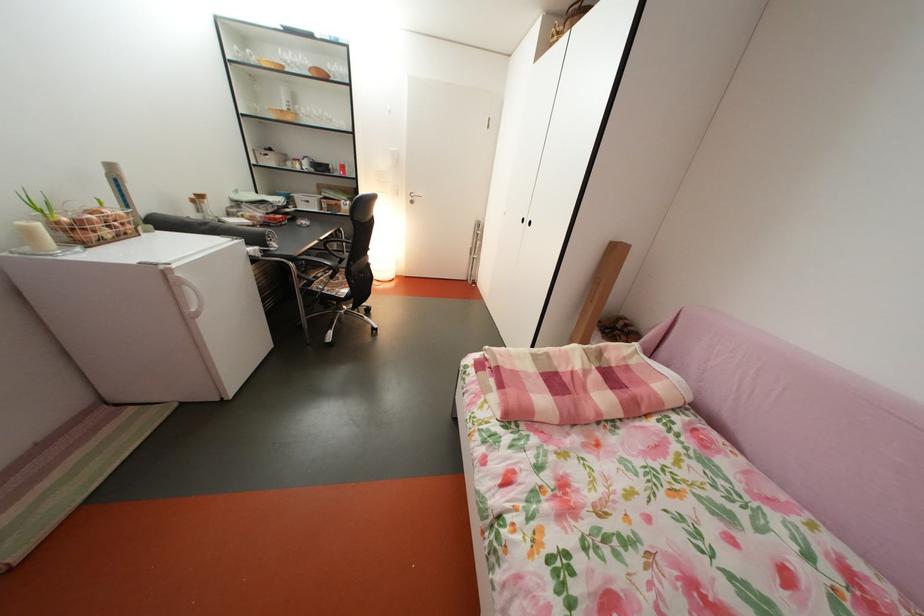
This screenshot has width=924, height=616. What do you see at coordinates (313, 262) in the screenshot?
I see `a black chair armrest` at bounding box center [313, 262].